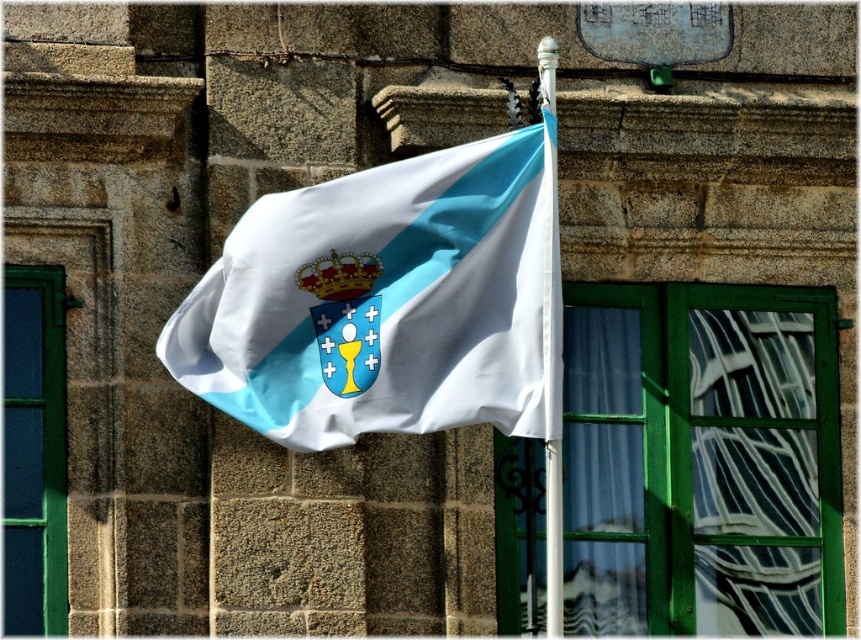
Question: Is white plastic flag pole at center below gold metallic crown at center?

Choices:
 (A) yes
 (B) no

Answer: (A)

Question: Which of the following is the farthest from the observer?

Choices:
 (A) (556, 524)
 (B) (330, 296)
 (C) (518, 301)

Answer: (B)

Question: Which point appears farthest from the camera in this image?

Choices:
 (A) (549, 346)
 (B) (307, 288)

Answer: (B)

Question: Is white plastic flag pole at center further to camera compared to gold metallic crown at center?

Choices:
 (A) no
 (B) yes

Answer: (A)

Question: Which of these objects is positioned closest to the white plastic flag pole at center?

Choices:
 (A) gold metallic crown at center
 (B) silky white flag at center

Answer: (A)

Question: Does silky white flag at center appear over gold metallic crown at center?

Choices:
 (A) yes
 (B) no

Answer: (B)